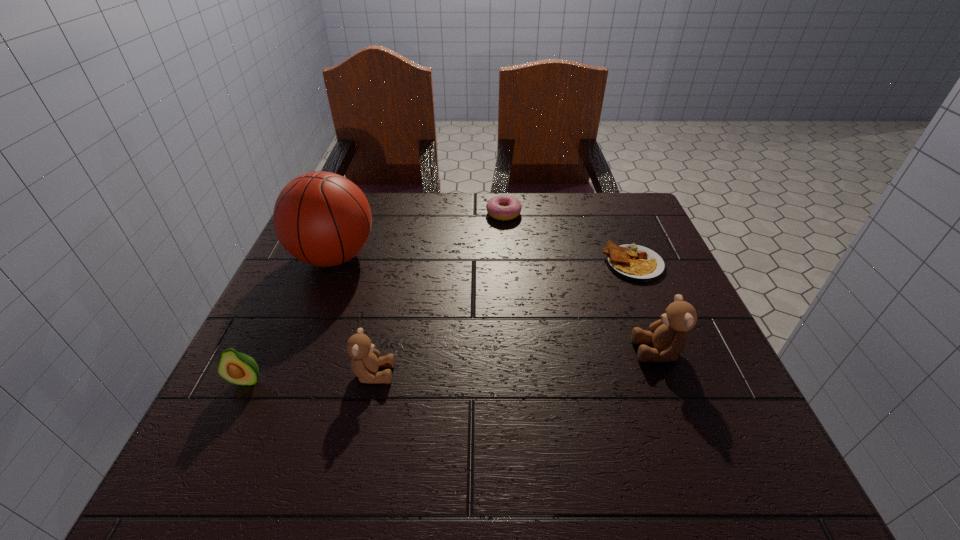
Find the location of a particular element. Image resolution: width=960 pixels, height=540 pixels. free spot located on the face of the second tallest object is located at coordinates (474, 351).

In order to click on free space located on the face of the second tallest object in this screenshot , I will do `click(464, 351)`.

What are the coordinates of `vacant space located 0.370m on the face of the second tallest object` in the screenshot? It's located at (444, 351).

This screenshot has width=960, height=540. What are the coordinates of `free space located on the right of the second shortest object` in the screenshot? It's located at (564, 213).

In order to click on free spot located 0.210m on the front of the basketball in this screenshot , I will do `click(293, 360)`.

In order to click on vacant region located 0.290m on the front of the shortest object in this screenshot , I will do `click(686, 390)`.

Where is `doughnut that is at the far edge`? doughnut that is at the far edge is located at coordinates (502, 207).

Locate an element on the screen. The height and width of the screenshot is (540, 960). basketball at the far edge is located at coordinates (323, 219).

Where is `teddy bear that is at the near edge`? The image size is (960, 540). teddy bear that is at the near edge is located at coordinates (365, 362).

The height and width of the screenshot is (540, 960). I want to click on avocado located at the near edge, so click(238, 368).